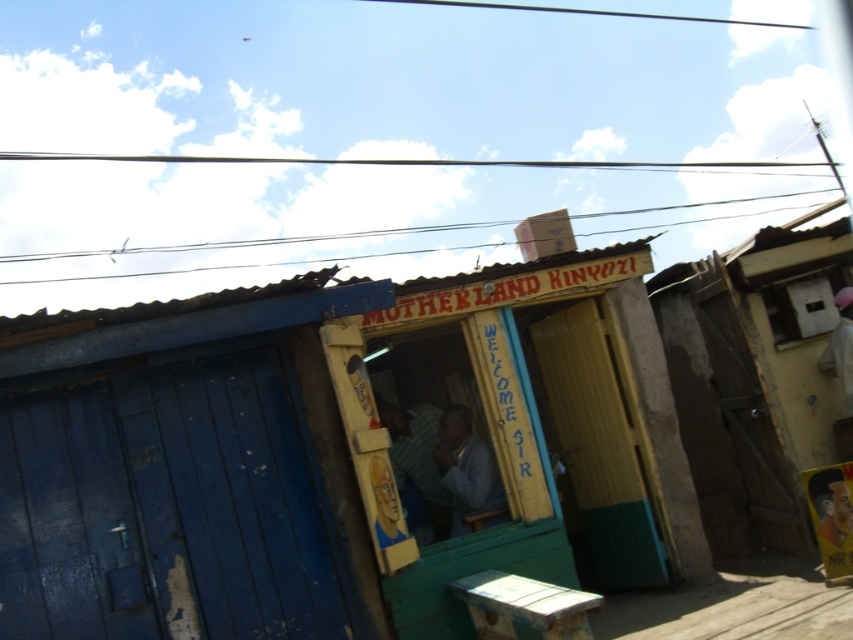
Is point (393, 417) behind point (721, 406)?

No, it is not.

Is wooden hut at center shorter than brown corrugated metal hut at center?

Correct, wooden hut at center is not as tall as brown corrugated metal hut at center.

This screenshot has height=640, width=853. What do you see at coordinates (328, 451) in the screenshot?
I see `wooden hut at center` at bounding box center [328, 451].

Find the location of a particular element. The width and height of the screenshot is (853, 640). wooden hut at center is located at coordinates (328, 451).

Who is positioned more to the left, brown corrugated metal hut at center or light blue fabric at center?

light blue fabric at center

Is point (796, 472) closer to viewer compared to point (442, 474)?

Yes, point (796, 472) is in front of point (442, 474).

Is point (787, 540) positioned before point (473, 474)?

No, it is behind (473, 474).

At what (x,y) coordinates should I click in order to perform the action: click on brown corrugated metal hut at center. Please return your answer as a coordinate pair (x, y). The width and height of the screenshot is (853, 640). Looking at the image, I should click on (755, 378).

Between wooden hut at center and light blue fabric at center, which one has more height?

With more height is wooden hut at center.

Is wooden hut at center positioned at the back of light blue fabric at center?

That is False.

Is point (90, 404) in front of point (497, 493)?

Yes.

This screenshot has width=853, height=640. Identify the location of wooden hut at center. (328, 451).